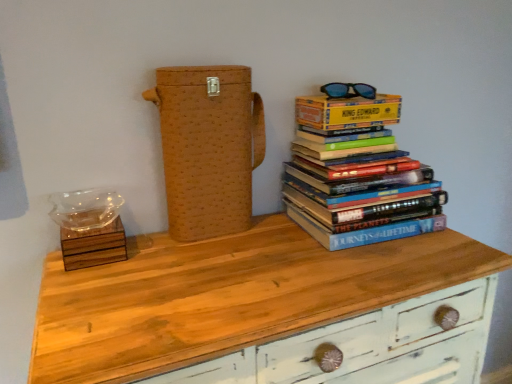
Question: Is yellow paper at upper right located outside brown woven box at center?

Choices:
 (A) no
 (B) yes

Answer: (B)

Question: Is yellow paper at upper right placed right next to brown woven box at center?

Choices:
 (A) yes
 (B) no

Answer: (B)

Question: From the image's perspective, does yellow paper at upper right appear lower than brown woven box at center?

Choices:
 (A) yes
 (B) no

Answer: (B)

Question: Is yellow paper at upper right facing away from brown woven box at center?

Choices:
 (A) no
 (B) yes

Answer: (A)

Question: Could you tell me if yellow paper at upper right is turned towards brown woven box at center?

Choices:
 (A) yes
 (B) no

Answer: (B)

Question: Considering their positions, is blue plastic sunglasses at upper right located in front of or behind wooden chest of drawers at center?

Choices:
 (A) behind
 (B) front

Answer: (A)

Question: In terms of height, does blue plastic sunglasses at upper right look taller or shorter compared to wooden chest of drawers at center?

Choices:
 (A) short
 (B) tall

Answer: (A)

Question: From the image's perspective, is blue plastic sunglasses at upper right above or below wooden chest of drawers at center?

Choices:
 (A) below
 (B) above

Answer: (B)

Question: Which is correct: blue plastic sunglasses at upper right is inside wooden chest of drawers at center, or outside of it?

Choices:
 (A) inside
 (B) outside

Answer: (B)

Question: From their relative heights in the image, would you say blue plastic sunglasses at upper right is taller or shorter than brown woven box at center?

Choices:
 (A) tall
 (B) short

Answer: (B)

Question: Is point (360, 92) positioned closer to the camera than point (242, 135)?

Choices:
 (A) farther
 (B) closer

Answer: (A)

Question: Is blue plastic sunglasses at upper right inside or outside of brown woven box at center?

Choices:
 (A) inside
 (B) outside

Answer: (B)

Question: From the image's perspective, is blue plastic sunglasses at upper right positioned above or below brown woven box at center?

Choices:
 (A) above
 (B) below

Answer: (A)

Question: Is point (308, 102) closer or farther from the camera than point (352, 84)?

Choices:
 (A) closer
 (B) farther

Answer: (A)

Question: Considering their positions, is yellow paper at upper right located in front of or behind blue plastic sunglasses at upper right?

Choices:
 (A) behind
 (B) front

Answer: (B)